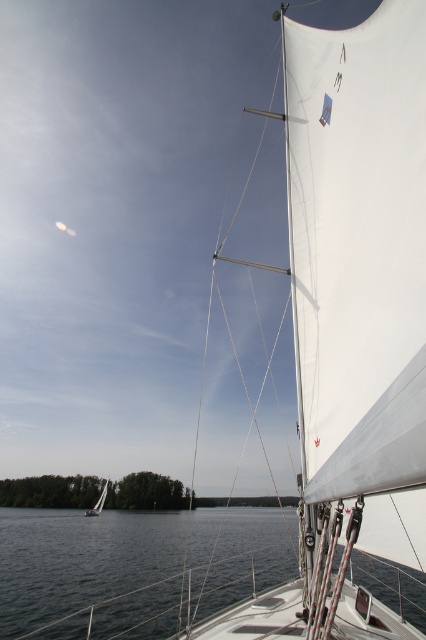
You are standing on the deck of the sailboat and want to retrieve an item that fell into the water. Which direction should you move to reach the dark blue water at lower center from the white matte sailboat at lower left?

The dark blue water at lower center is to the right of the white matte sailboat at lower left, so you should move to the right to reach it.

You are standing on the deck of the sailboat and want to jump into the water. Which object, the dark blue water at lower center or the white matte sailboat at lower left, is closer to you when you look down?

The dark blue water at lower center is closer to you than the white matte sailboat at lower left, so you should jump into the dark blue water at lower center.